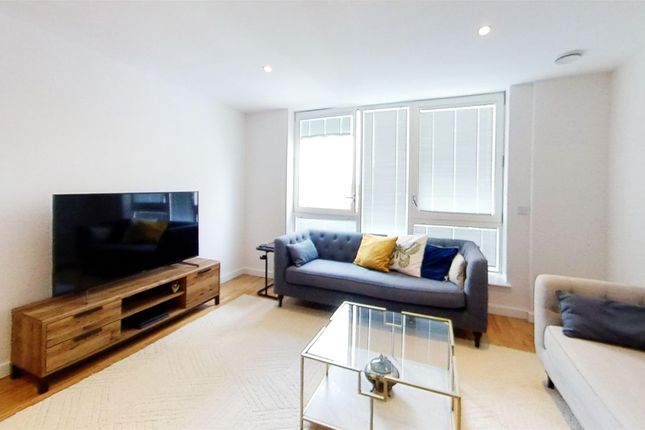
Identify the location of light switch. (522, 210).